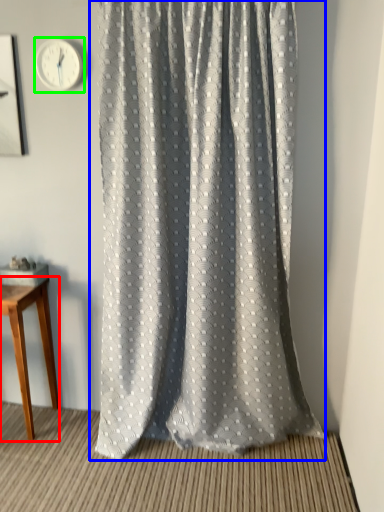
Question: Estimate the real-world distances between objects in this image. Which object is farther from table (highlighted by a red box), curtain (highlighted by a blue box) or clock (highlighted by a green box)?

Choices:
 (A) curtain
 (B) clock

Answer: (B)